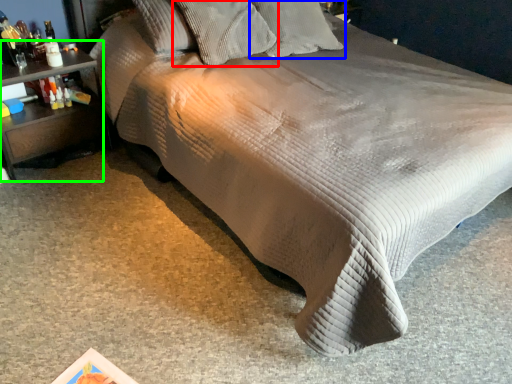
Question: Which is farther away from pillow (highlighted by a red box)? pillow (highlighted by a blue box) or nightstand (highlighted by a green box)?

Choices:
 (A) pillow
 (B) nightstand

Answer: (B)